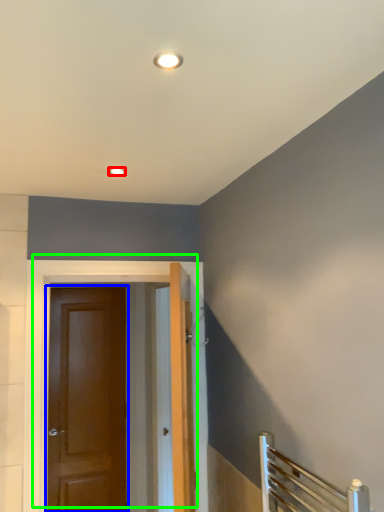
Question: Which object is positioned closest to lighting (highlighted by a red box)? Select from door (highlighted by a blue box) and door (highlighted by a green box).

Choices:
 (A) door
 (B) door

Answer: (B)